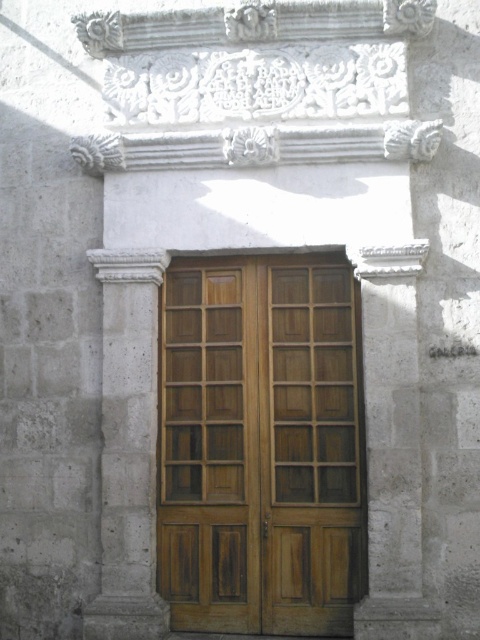
Question: Which point is farther to the camera?

Choices:
 (A) (169, 432)
 (B) (184, 371)

Answer: (B)

Question: Does wooden/glass door at center appear over wooden door at center?

Choices:
 (A) yes
 (B) no

Answer: (A)

Question: Is wooden/glass door at center further to the viewer compared to wooden door at center?

Choices:
 (A) no
 (B) yes

Answer: (A)

Question: Can you confirm if wooden/glass door at center is wider than wooden door at center?

Choices:
 (A) yes
 (B) no

Answer: (A)

Question: Among these points, which one is nearest to the camera?

Choices:
 (A) (201, 300)
 (B) (239, 282)

Answer: (B)

Question: Which object is closer to the camera taking this photo?

Choices:
 (A) wooden/glass door at center
 (B) wooden door at center

Answer: (A)